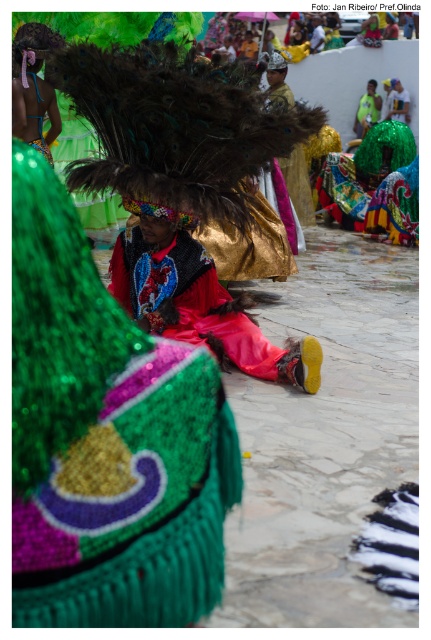
You are a photographer trying to capture the festive atmosphere. You notice the shiny sequined skirt at center and the shiny sequined headdress at upper left. Which object takes up more space in the photo?

The shiny sequined headdress at upper left takes up more space in the photo than the shiny sequined skirt at center because it occupies more area according to the description.

In the festive scene, there is a person wearing a large headdress and a red garment with intricate patterns. The shiny sequined skirt at center is located at point (106, 440). Where is the shiny sequined skirt in relation to the person?

The shiny sequined skirt at center is located at point (106, 440), which is the center of the image frame. Since the person is sitting in the foreground with their headdress taking up a significant portion of the frame, the skirt is likely positioned at the lower half of the person, near their waist or hips.